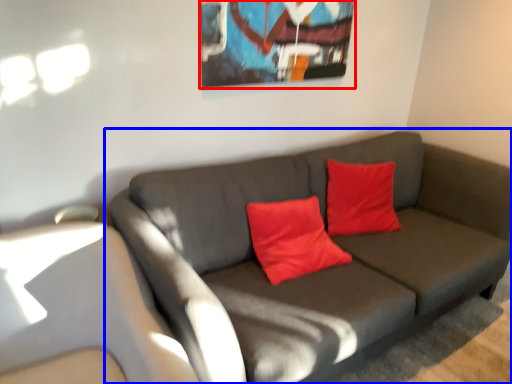
Question: Which of the following is the closest to the observer, picture frame (highlighted by a red box) or studio couch (highlighted by a blue box)?

Choices:
 (A) picture frame
 (B) studio couch

Answer: (B)